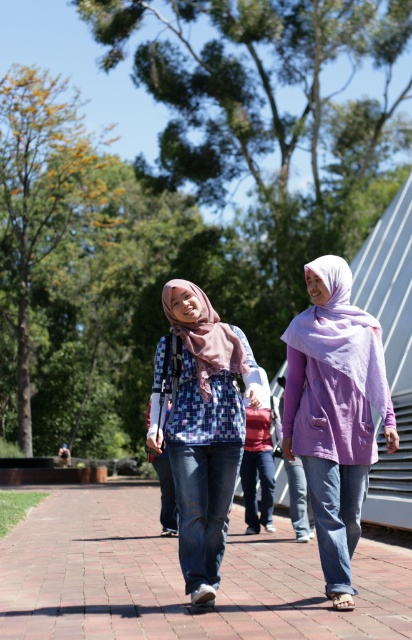
You are standing at the point with coordinates (x=180, y=579) in the image. What type of surface are you currently standing on?

The point at (x=180, y=579) indicates brick pavement at center, so you are standing on brick pavement.

You are a photographer standing at the pathway. You want to take a photo of the brick pavement at center and the mauve chiffon hijab at center. Which object should you focus on first to ensure both are in sharp focus?

You should focus on the brick pavement at center first since it is closer to the viewer than the mauve chiffon hijab at center, ensuring both will be in focus when using a small aperture for depth of field.

You are a photographer standing at the end of the pathway. You want to take a photo that includes both the brick pavement at center and the plaid fabric blouse at center. Which object should you focus on first to ensure both are in the frame?

The brick pavement at center is below the plaid fabric blouse at center, so you should focus on the plaid fabric blouse at center first to ensure both are in the frame.